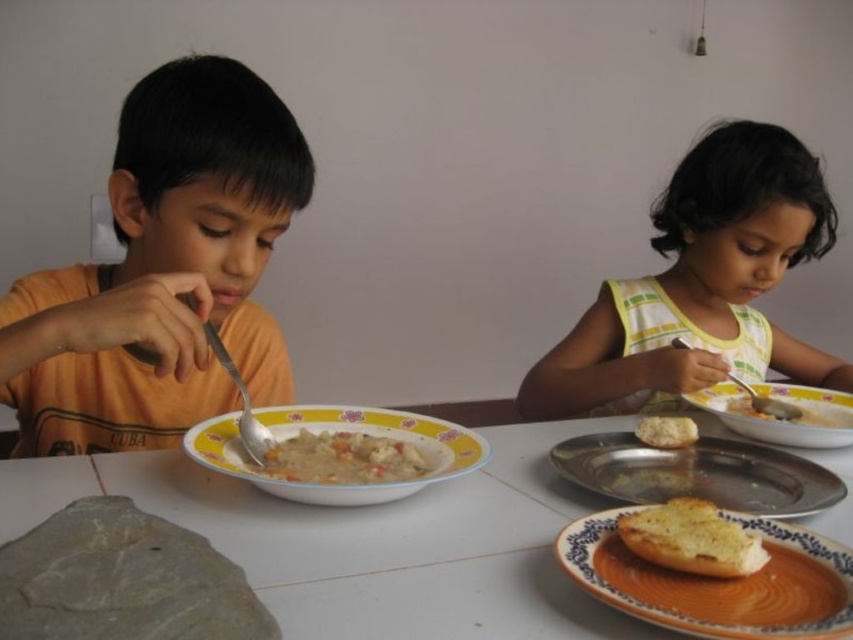
Locate an element on the screen. white glossy table at center is located at coordinates (372, 541).

Is white glossy table at center thinner than orange glazed plate at lower right?

No, white glossy table at center is not thinner than orange glazed plate at lower right.

Between point (488, 532) and point (740, 625), which one is positioned behind?

Point (488, 532)

Find the location of a particular element. This screenshot has height=640, width=853. white glossy table at center is located at coordinates (372, 541).

Can you confirm if yellow printed fabric at upper right is shorter than white bread at right?

In fact, yellow printed fabric at upper right may be taller than white bread at right.

Is point (744, 145) positioned in front of point (843, 396)?

No, it is behind (843, 396).

At what (x,y) coordinates should I click in order to perform the action: click on yellow printed fabric at upper right. Please return your answer as a coordinate pair (x, y). The image size is (853, 640). Looking at the image, I should click on (701, 284).

Can you confirm if orange glazed plate at lower right is thinner than matte ceramic bowl at lower right?

Yes, orange glazed plate at lower right is thinner than matte ceramic bowl at lower right.

Who is more forward, (793, 616) or (750, 433)?

Point (793, 616) is in front.

Measure the distance between orange glazed plate at lower right and camera.

orange glazed plate at lower right and camera are 16.93 inches apart.

You are a GUI agent. You are given a task and a screenshot of the screen. Output one action in this format:
    pyautogui.click(x=<x>, y=<y>)
    Task: Click on the orange glazed plate at lower right
    
    Given the screenshot: What is the action you would take?
    pyautogui.click(x=718, y=582)